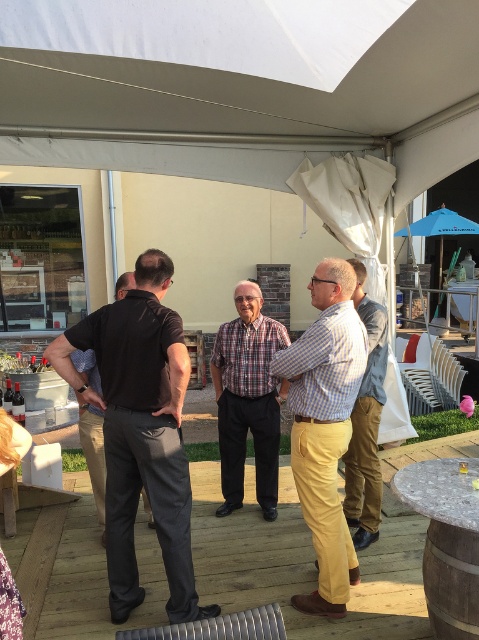
You are organizing a game that requires participants to stand in order of their clothing size. If you see the plaid fabric shirt at center and the light blue checkered shirt at center, which shirt should be placed first in the line from largest to smallest?

The plaid fabric shirt at center should be placed first in the line since it is larger in size than the light blue checkered shirt at center.

You are a photographer at the event and need to capture a group photo of the checkered fabric shirt at center and the other two men. The camera you are using has a maximum focus range of 10 feet. Will you be able to capture all three subjects in focus if they remain at their current positions?

Yes, since the checkered fabric shirt at center and the other two men are 9.60 feet apart, which is within the camera maximum focus range of 10 feet, so all three subjects can be captured in focus.

Based on the photo, you are standing at the camera position and want to know how far the point at coordinates (299, 452) is from you. Can you determine the distance?

The point at coordinates (299, 452) is 9.93 feet away from the camera position.